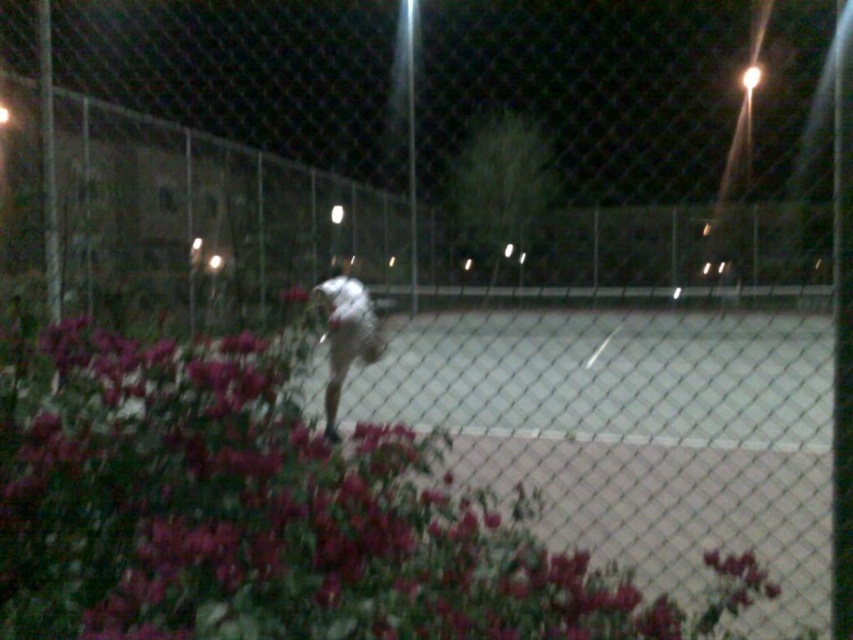
Who is positioned more to the left, purple matte flowers at center or white fabric shirt at center?

white fabric shirt at center is more to the left.

Locate an element on the screen. The image size is (853, 640). purple matte flowers at center is located at coordinates [x=254, y=516].

Who is more distant from viewer, (601, 625) or (355, 333)?

The point (355, 333) is behind.

The image size is (853, 640). In order to click on purple matte flowers at center in this screenshot , I will do `click(254, 516)`.